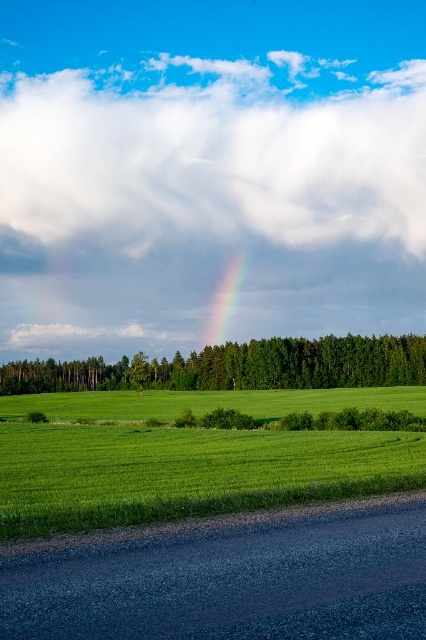
Does white fluffy cloud at upper center have a larger size compared to rainbow at center?

Indeed, white fluffy cloud at upper center has a larger size compared to rainbow at center.

Who is more distant from viewer, (55, 99) or (215, 321)?

Positioned behind is point (55, 99).

Image resolution: width=426 pixels, height=640 pixels. In order to click on white fluffy cloud at upper center in this screenshot , I will do `click(213, 161)`.

The image size is (426, 640). What are the coordinates of `white fluffy cloud at upper center` in the screenshot? It's located at [x=213, y=161].

Between green grassy field at center and rainbow at center, which one is positioned higher?

rainbow at center is higher up.

Does green grassy field at center appear on the right side of rainbow at center?

No, green grassy field at center is not to the right of rainbow at center.

Who is more forward, [276,492] or [238,276]?

Point [276,492] is more forward.

Where is `green grassy field at center`? green grassy field at center is located at coordinates (190, 458).

Is green grassy field at center closer to the viewer compared to green leafy tree at center?

Yes.

Who is more distant from viewer, (158,499) or (406,346)?

The point (406,346) is behind.

The height and width of the screenshot is (640, 426). What are the coordinates of `green grassy field at center` in the screenshot? It's located at (190, 458).